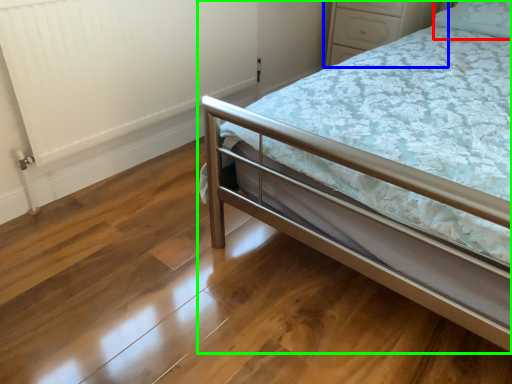
Question: Which object is positioned farthest from pillow (highlighted by a red box)? Select from dresser (highlighted by a blue box) and bed (highlighted by a green box).

Choices:
 (A) dresser
 (B) bed

Answer: (B)